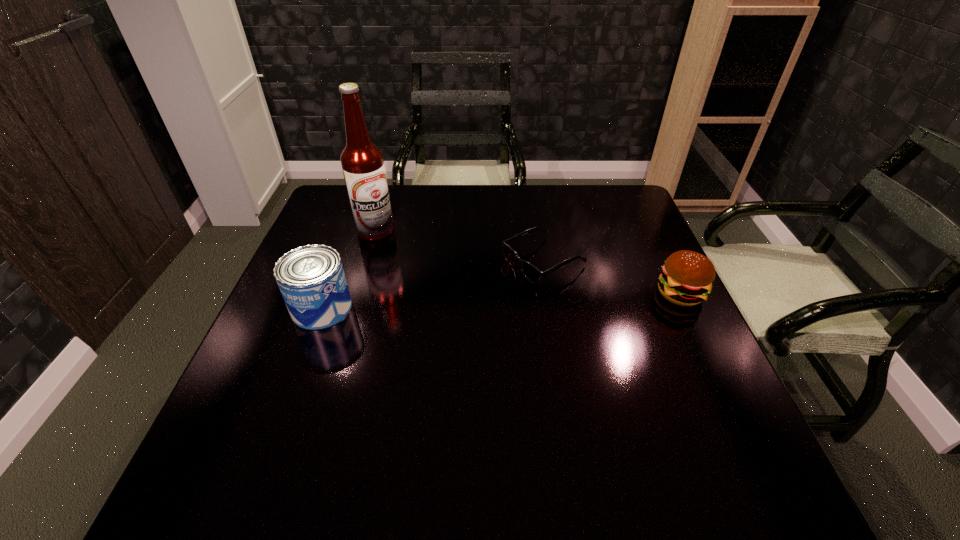
The height and width of the screenshot is (540, 960). In the image, there is a desktop. Find the location of `vacant space at the near edge`. vacant space at the near edge is located at coordinates (316, 427).

Identify the location of vacant space at the right edge of the desktop. This screenshot has height=540, width=960. pyautogui.click(x=654, y=248).

Where is `free space at the far left corner of the desktop`? The image size is (960, 540). free space at the far left corner of the desktop is located at coordinates (337, 195).

Locate an element on the screen. The width and height of the screenshot is (960, 540). blank area at the near left corner is located at coordinates (233, 422).

Image resolution: width=960 pixels, height=540 pixels. Find the location of `vacant space at the far right corner of the desktop`. vacant space at the far right corner of the desktop is located at coordinates (610, 227).

This screenshot has width=960, height=540. Identify the location of vacant area at the near right corner. (725, 436).

Identify the location of blank region between the alcohol and the third tallest object. (528, 262).

Identify the location of vacant space that's between the third shortest object and the hamburger. This screenshot has height=540, width=960. (501, 301).

The height and width of the screenshot is (540, 960). I want to click on vacant space that's between the tallest object and the second tallest object, so click(x=348, y=269).

I want to click on empty space that is in between the second object from right to left and the can, so click(x=433, y=285).